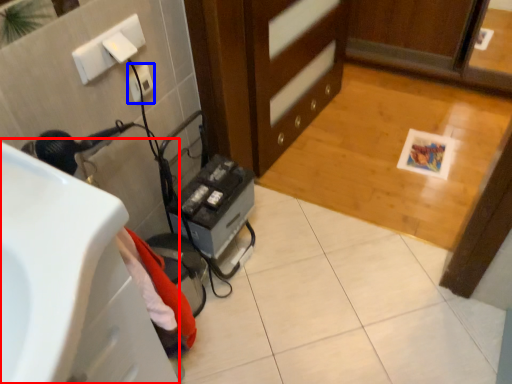
Question: Which point is closer to the camera, sink (highlighted by a red box) or electric outlet (highlighted by a blue box)?

Choices:
 (A) sink
 (B) electric outlet

Answer: (A)